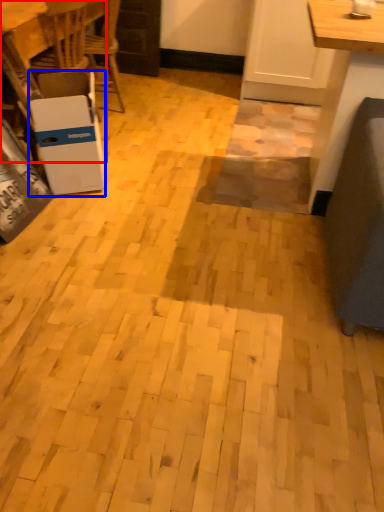
Question: Among these objects, which one is farthest to the camera, table (highlighted by a red box) or cardboard box (highlighted by a blue box)?

Choices:
 (A) table
 (B) cardboard box

Answer: (A)